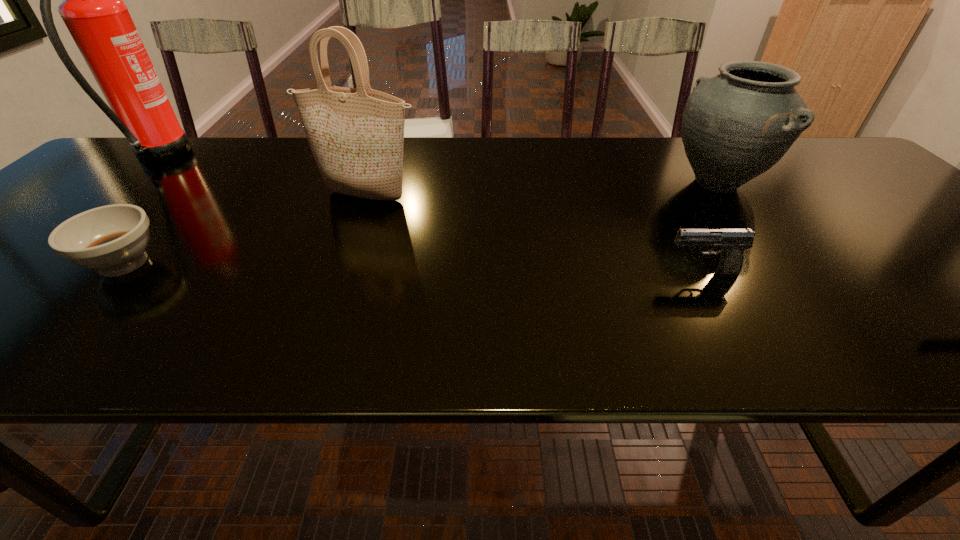
Locate an element on the screen. vacant space at the left edge is located at coordinates (40, 220).

Identify the location of vacant space at the right edge of the desktop. Image resolution: width=960 pixels, height=540 pixels. (900, 208).

Identify the location of free spot between the second object from left to right and the pistol. This screenshot has width=960, height=540. (413, 268).

Locate an element on the screen. Image resolution: width=960 pixels, height=540 pixels. free space that is in between the second object from left to right and the third tallest object is located at coordinates (420, 223).

Where is `free space between the pistol and the soup bowl`? free space between the pistol and the soup bowl is located at coordinates (413, 268).

Identify the location of empty location between the urn and the second object from left to right. (420, 223).

At what (x,y) coordinates should I click in order to perform the action: click on free space that is in between the third shortest object and the tallest object. Please return your answer as a coordinate pair (x, y). The width and height of the screenshot is (960, 540). Looking at the image, I should click on (437, 170).

Where is `empty space that is in between the pistol and the shopping bag`? The height and width of the screenshot is (540, 960). empty space that is in between the pistol and the shopping bag is located at coordinates (534, 234).

Locate an element on the screen. The height and width of the screenshot is (540, 960). the fourth closest object relative to the soup bowl is located at coordinates (735, 126).

You are a GUI agent. You are given a task and a screenshot of the screen. Output one action in this format:
    pyautogui.click(x=<x>, y=<y>)
    Task: Click on the third closest object to the tallest object
    The image size is (960, 540).
    Given the screenshot: What is the action you would take?
    pyautogui.click(x=733, y=241)